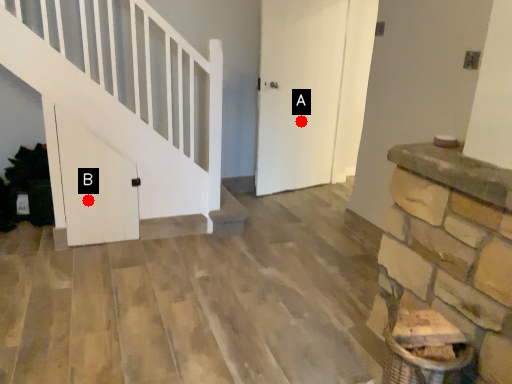
Question: Two points are circled on the image, labeled by A and B beside each circle. Among these points, which one is nearest to the camera?

Choices:
 (A) A is closer
 (B) B is closer

Answer: (B)